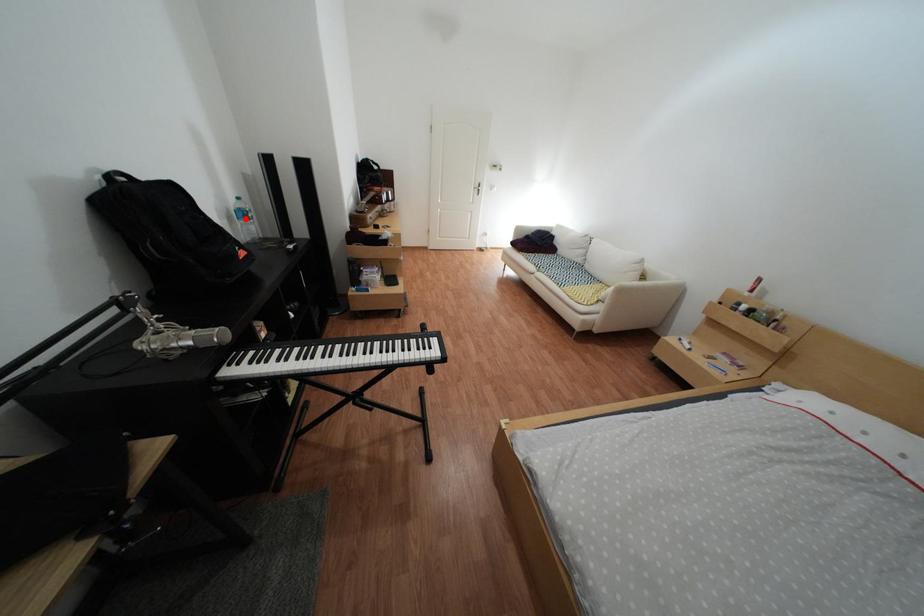
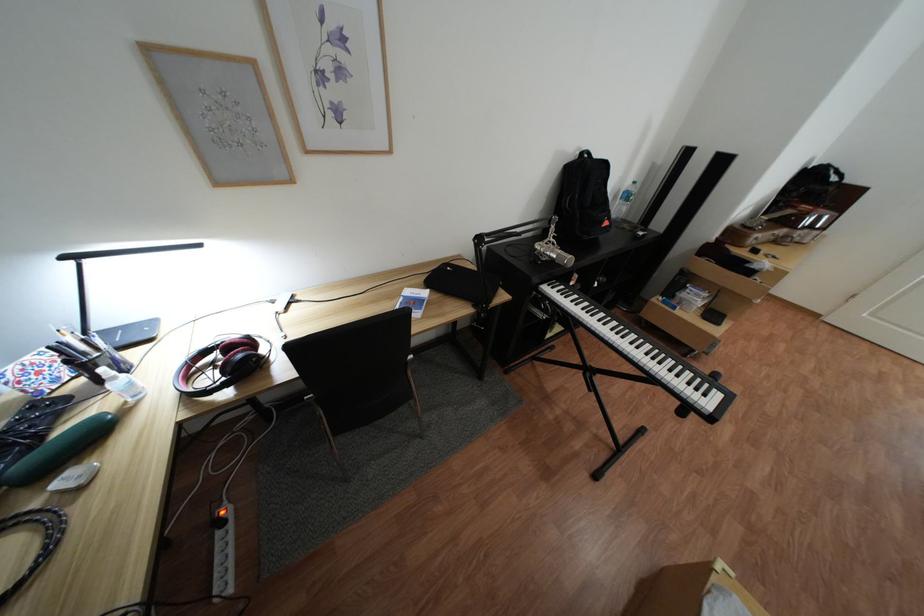
Locate, in the second image, the point that corresponds to the highlighted location in the first image.

(630, 197)